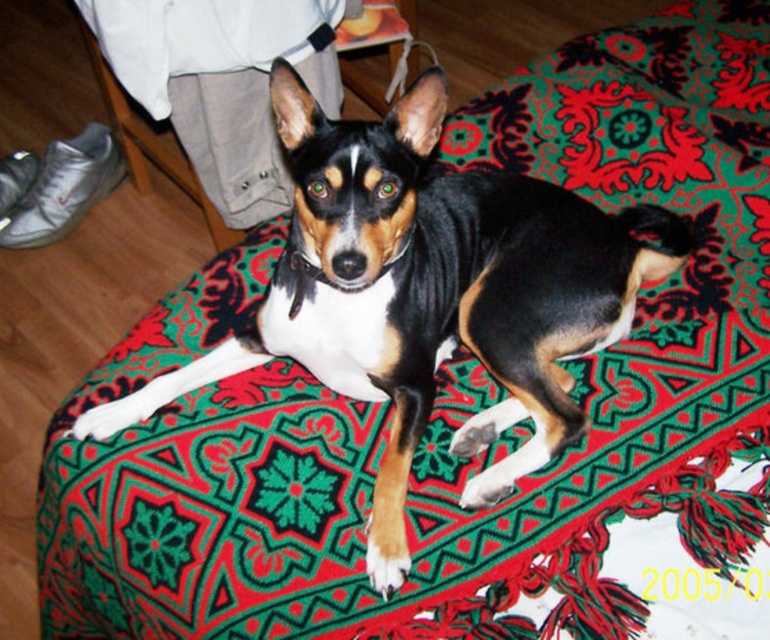
You are a photographer setting up a shoot. You have a black and tan fur dog at center and a patterned fabric cushion at center in your frame. Based on the scene, which object is taller?

The black and tan fur dog at center is much taller than the patterned fabric cushion at center.

You are a photographer trying to capture the black and tan fur dog at center and the patterned fabric cushion at center in a single shot. Based on their positions, which object will appear closer to the camera in the photo?

The black and tan fur dog at center appears closer to the camera because it is in front of the patterned fabric cushion at center.